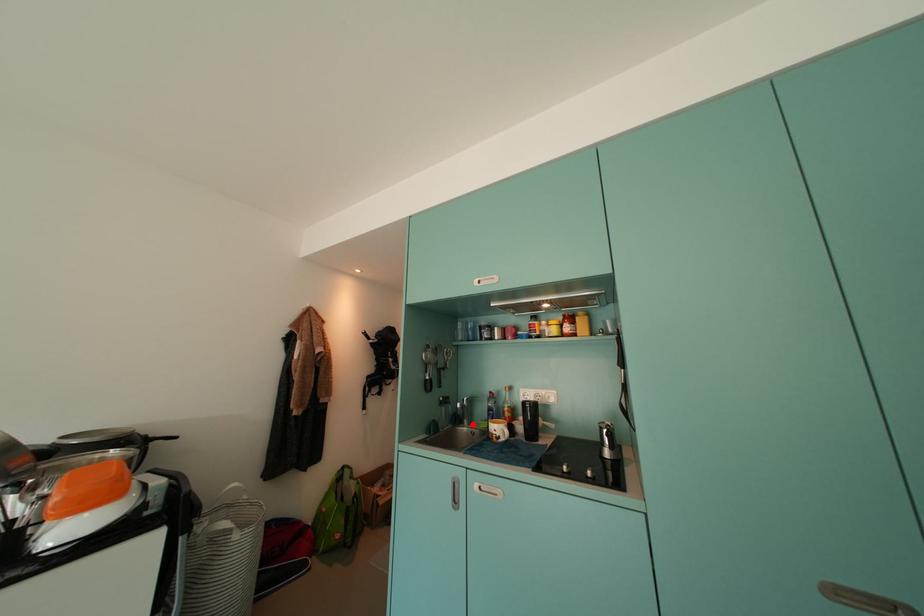
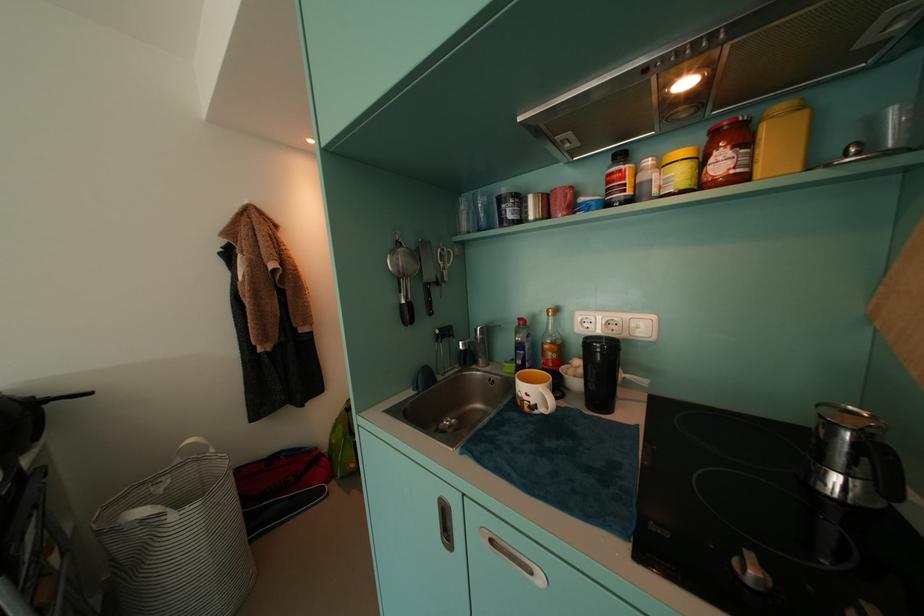
Question: I am providing you with two images of the same scene from different viewpoints. A red point is marked on the first image. Is the red point's position out of view in image 2?

Choices:
 (A) Yes
 (B) No

Answer: (B)